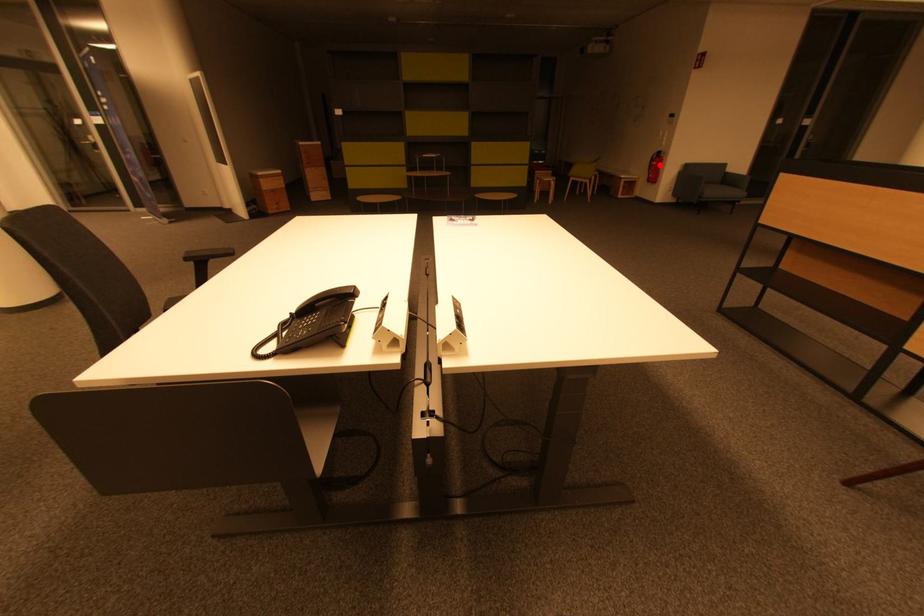
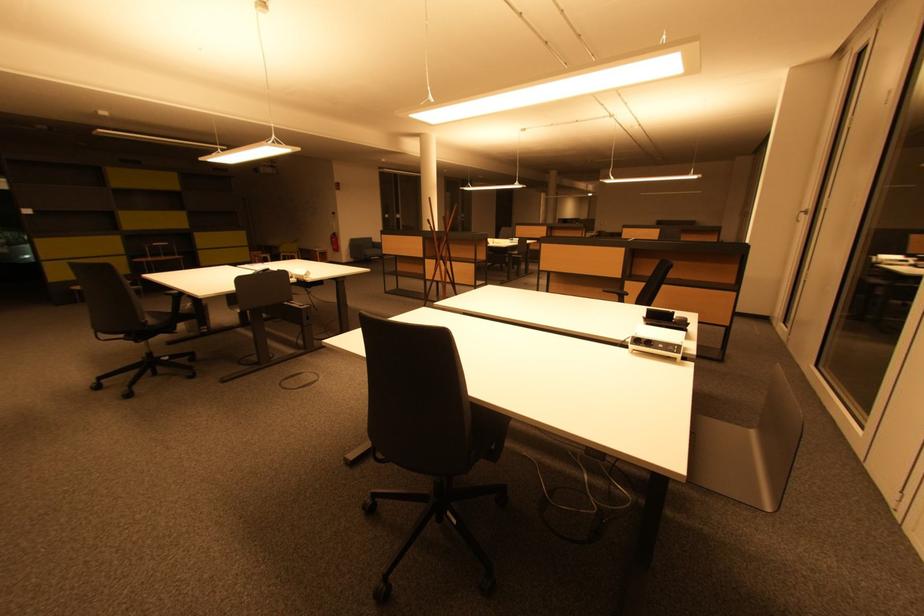
Question: I am providing you with two images of the same scene from different viewpoints. Image1 has a red point marked. In image2, the corresponding 3D location appears at what relative position? Reply with the corresponding letter.

Choices:
 (A) Closer
 (B) Farther

Answer: (A)